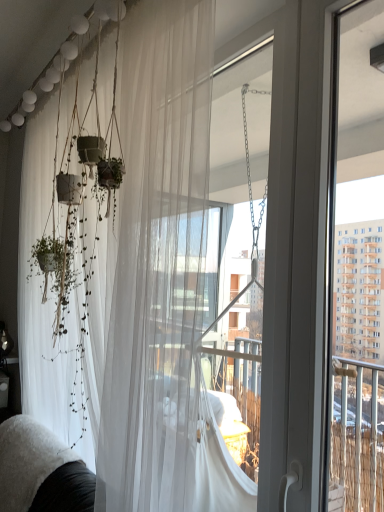
This screenshot has width=384, height=512. What do you see at coordinates (41, 471) in the screenshot? I see `white fluffy couch at lower left` at bounding box center [41, 471].

Locate an element on the screen. Image resolution: width=384 pixels, height=512 pixels. white fluffy couch at lower left is located at coordinates (41, 471).

The height and width of the screenshot is (512, 384). In order to click on translucent white curtain at left in this screenshot , I will do [128, 267].

The width and height of the screenshot is (384, 512). What do you see at coordinates (128, 267) in the screenshot?
I see `translucent white curtain at left` at bounding box center [128, 267].

Find the location of `white fluffy couch at lower left`. white fluffy couch at lower left is located at coordinates (41, 471).

Considering the positions of objects translucent white curtain at left and white fluffy couch at lower left in the image provided, who is more to the right, translucent white curtain at left or white fluffy couch at lower left?

translucent white curtain at left is more to the right.

In the scene shown: Which object is closer to the camera taking this photo, translucent white curtain at left or white fluffy couch at lower left?

translucent white curtain at left is closer to the camera.

Which point is more forward, (x=62, y=95) or (x=81, y=511)?

The point (x=81, y=511) is more forward.

From the image's perspective, which object appears higher, translucent white curtain at left or white fluffy couch at lower left?

translucent white curtain at left is shown above in the image.

From a real-world perspective, is translucent white curtain at left beneath white fluffy couch at lower left?

Actually, translucent white curtain at left is physically above white fluffy couch at lower left in the real world.

Between translucent white curtain at left and white fluffy couch at lower left, which one has larger width?

translucent white curtain at left.

Who is shorter, translucent white curtain at left or white fluffy couch at lower left?

With less height is white fluffy couch at lower left.

In terms of size, does translucent white curtain at left appear bigger or smaller than white fluffy couch at lower left?

Considering their sizes, translucent white curtain at left takes up more space than white fluffy couch at lower left.

Is translucent white curtain at left positioned beyond the bounds of white fluffy couch at lower left?

Indeed, translucent white curtain at left is completely outside white fluffy couch at lower left.

In the scene shown: Is translucent white curtain at left positioned far away from white fluffy couch at lower left?

No, translucent white curtain at left is not far away from white fluffy couch at lower left.

Is translucent white curtain at left looking in the opposite direction of white fluffy couch at lower left?

No, translucent white curtain at left is not facing the opposite direction of white fluffy couch at lower left.

What's the angular difference between translucent white curtain at left and white fluffy couch at lower left's facing directions?

translucent white curtain at left and white fluffy couch at lower left are facing 6.28 degrees away from each other.

Where is `curtain above the white fluffy couch at lower left (from a real-world perspective)`? curtain above the white fluffy couch at lower left (from a real-world perspective) is located at coordinates (128, 267).

Is white fluffy couch at lower left to the right of translucent white curtain at left from the viewer's perspective?

Incorrect, white fluffy couch at lower left is not on the right side of translucent white curtain at left.

Is white fluffy couch at lower left further to the viewer compared to translucent white curtain at left?

Yes, it is behind translucent white curtain at left.

Considering the positions of point (63, 470) and point (57, 226), is point (63, 470) closer or farther from the camera than point (57, 226)?

Point (63, 470) is closer to the camera than point (57, 226).

From the image's perspective, is white fluffy couch at lower left above or below translucent white curtain at left?

Based on their image positions, white fluffy couch at lower left is located beneath translucent white curtain at left.

In the scene shown: From a real-world perspective, which object stands above the other?

In real-world perspective, translucent white curtain at left is above.

Can you confirm if white fluffy couch at lower left is wider than translucent white curtain at left?

No.

In terms of height, does white fluffy couch at lower left look taller or shorter compared to translucent white curtain at left?

Considering their sizes, white fluffy couch at lower left has less height than translucent white curtain at left.

Considering the sizes of white fluffy couch at lower left and translucent white curtain at left in the image, is white fluffy couch at lower left bigger or smaller than translucent white curtain at left?

In the image, white fluffy couch at lower left appears to be smaller than translucent white curtain at left.

Is white fluffy couch at lower left completely or partially outside of translucent white curtain at left?

white fluffy couch at lower left lies outside translucent white curtain at left's area.

Is the surface of white fluffy couch at lower left in direct contact with translucent white curtain at left?

white fluffy couch at lower left is not next to translucent white curtain at left, and they're not touching.

Looking at this image, could you tell me if white fluffy couch at lower left is turned towards translucent white curtain at left?

No, white fluffy couch at lower left is not aimed at translucent white curtain at left.

What's the angular difference between white fluffy couch at lower left and translucent white curtain at left's facing directions?

white fluffy couch at lower left and translucent white curtain at left are facing 6.28 degrees away from each other.

At what (x,y) coordinates should I click in order to perform the action: click on couch that appears behind the translucent white curtain at left. Please return your answer as a coordinate pair (x, y). This screenshot has height=512, width=384. Looking at the image, I should click on (41, 471).

Locate an element on the screen. couch directly beneath the translucent white curtain at left (from a real-world perspective) is located at coordinates (41, 471).

Identify the location of curtain in front of the white fluffy couch at lower left. (128, 267).